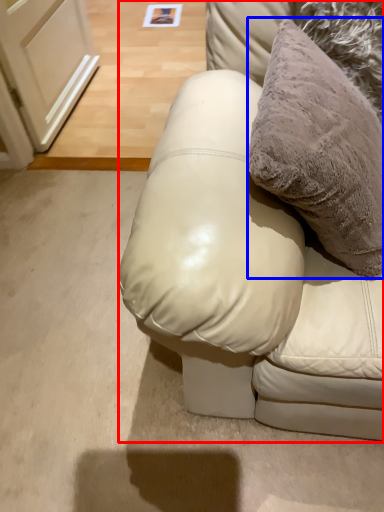
Question: Among these objects, which one is farthest to the camera, furniture (highlighted by a red box) or pillow (highlighted by a blue box)?

Choices:
 (A) furniture
 (B) pillow

Answer: (B)